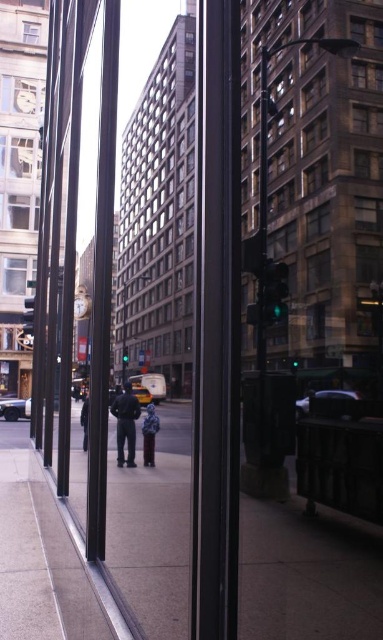
Question: Which object is positioned farthest from the blue denim jacket at center?

Choices:
 (A) clear glass window at upper left
 (B) dark blue jacket at center
 (C) smooth concrete sidewalk at center
 (D) dark blue jeans at center

Answer: (A)

Question: Is dark blue jeans at center to the right of dark blue jacket at center from the viewer's perspective?

Choices:
 (A) no
 (B) yes

Answer: (B)

Question: Considering the relative positions of clear glass window at upper left and dark blue jacket at center in the image provided, where is clear glass window at upper left located with respect to dark blue jacket at center?

Choices:
 (A) left
 (B) right

Answer: (A)

Question: From the image, what is the correct spatial relationship of dark blue jeans at center in relation to blue denim jacket at center?

Choices:
 (A) above
 (B) below

Answer: (B)

Question: Which is nearer to the dark blue jacket at center?

Choices:
 (A) clear glass window at upper left
 (B) blue denim jacket at center
 (C) dark blue jeans at center

Answer: (C)

Question: Which object is closer to the camera taking this photo?

Choices:
 (A) clear glass window at upper left
 (B) dark blue jacket at center

Answer: (B)